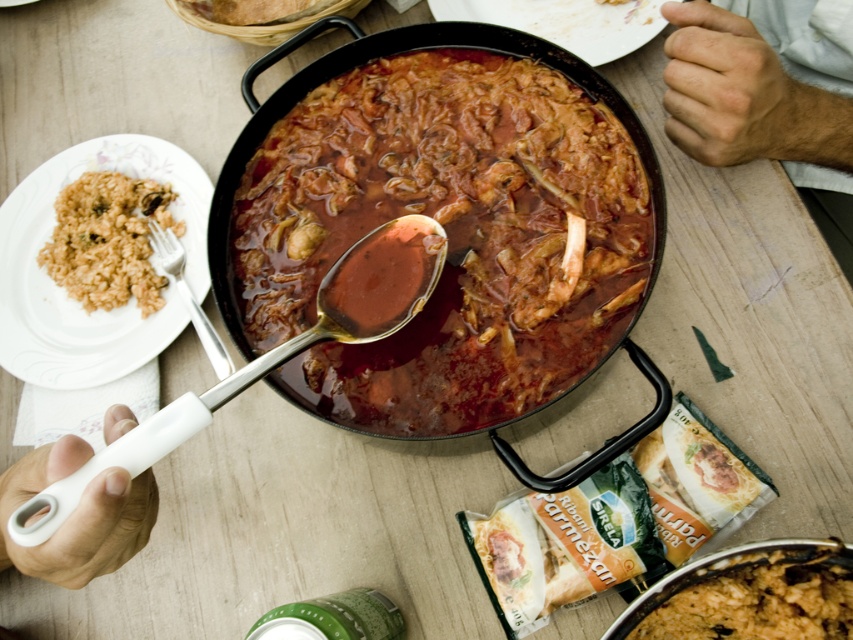
Based on the photo, which is below, white plastic spoon at center or brown matte rice at lower right?

brown matte rice at lower right

I want to click on white plastic spoon at center, so click(x=271, y=356).

Is point (340, 308) closer to viewer compared to point (814, 579)?

No, (340, 308) is further to viewer.

Identify the location of white plastic spoon at center. The width and height of the screenshot is (853, 640). (271, 356).

Does brown glossy stew at center lie in front of white plastic spoon at center?

No, brown glossy stew at center is behind white plastic spoon at center.

Does brown glossy stew at center appear under white plastic spoon at center?

No, brown glossy stew at center is not below white plastic spoon at center.

Which is in front, point (608, 285) or point (172, 403)?

Point (172, 403) is more forward.

Identify the location of brown glossy stew at center. (447, 234).

Is skinny white shirt at upper right positioned before white plastic spoon at center?

No, skinny white shirt at upper right is further to the viewer.

Between point (718, 64) and point (399, 304), which one is positioned in front?

Point (399, 304)

Locate an element on the screen. skinny white shirt at upper right is located at coordinates (746, 97).